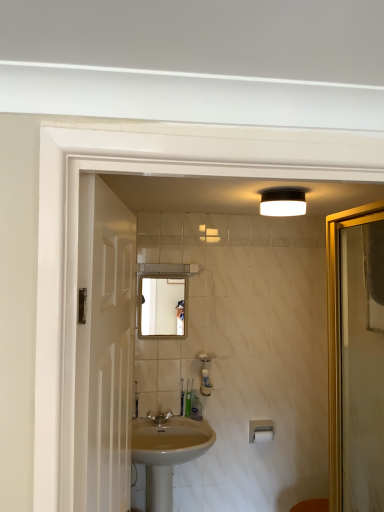
Question: Considering the relative sizes of white glossy screen door at left and matte silver faucet at center in the image provided, is white glossy screen door at left wider than matte silver faucet at center?

Choices:
 (A) yes
 (B) no

Answer: (A)

Question: Can you see white glossy screen door at left touching matte silver faucet at center?

Choices:
 (A) no
 (B) yes

Answer: (A)

Question: From the image's perspective, is white glossy screen door at left beneath matte silver faucet at center?

Choices:
 (A) no
 (B) yes

Answer: (A)

Question: Considering the relative sizes of white glossy screen door at left and matte silver faucet at center in the image provided, is white glossy screen door at left thinner than matte silver faucet at center?

Choices:
 (A) no
 (B) yes

Answer: (A)

Question: Can you confirm if white glossy screen door at left is bigger than matte silver faucet at center?

Choices:
 (A) yes
 (B) no

Answer: (A)

Question: Considering the positions of white matte light fixture at upper center and beige ceramic sink at center in the image, is white matte light fixture at upper center wider or thinner than beige ceramic sink at center?

Choices:
 (A) thin
 (B) wide

Answer: (A)

Question: Choose the correct answer: Is white matte light fixture at upper center inside beige ceramic sink at center or outside it?

Choices:
 (A) inside
 (B) outside

Answer: (B)

Question: Visually, is white matte light fixture at upper center positioned to the left or to the right of beige ceramic sink at center?

Choices:
 (A) right
 (B) left

Answer: (A)

Question: Is white matte light fixture at upper center bigger or smaller than beige ceramic sink at center?

Choices:
 (A) big
 (B) small

Answer: (B)

Question: Looking at their shapes, would you say green plastic toothbrush at center, the 1th toiletry from the left, is wider or thinner than white matte light fixture at upper center?

Choices:
 (A) thin
 (B) wide

Answer: (A)

Question: Does point (183, 401) appear closer or farther from the camera than point (283, 190)?

Choices:
 (A) farther
 (B) closer

Answer: (A)

Question: Relative to white matte light fixture at upper center, is green plastic toothbrush at center, the third toiletry when ordered from right to left, in front or behind?

Choices:
 (A) front
 (B) behind

Answer: (B)

Question: Is green plastic toothbrush at center, the third toiletry when ordered from right to left, inside the boundaries of white matte light fixture at upper center, or outside?

Choices:
 (A) inside
 (B) outside

Answer: (B)

Question: From the image's perspective, is white matte light fixture at upper center located above or below white matte toilet paper at lower center?

Choices:
 (A) below
 (B) above

Answer: (B)

Question: Does point (261, 212) appear closer or farther from the camera than point (271, 430)?

Choices:
 (A) closer
 (B) farther

Answer: (A)